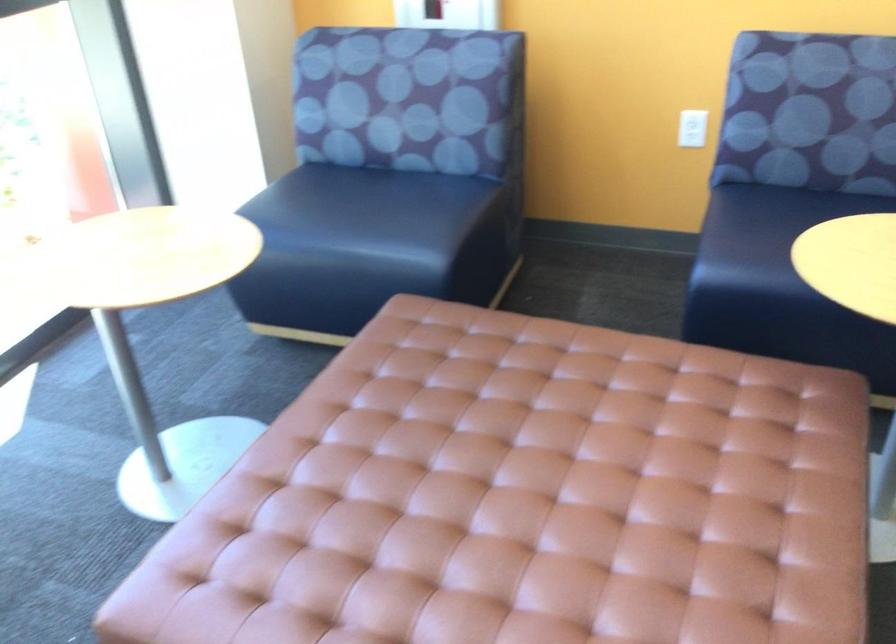
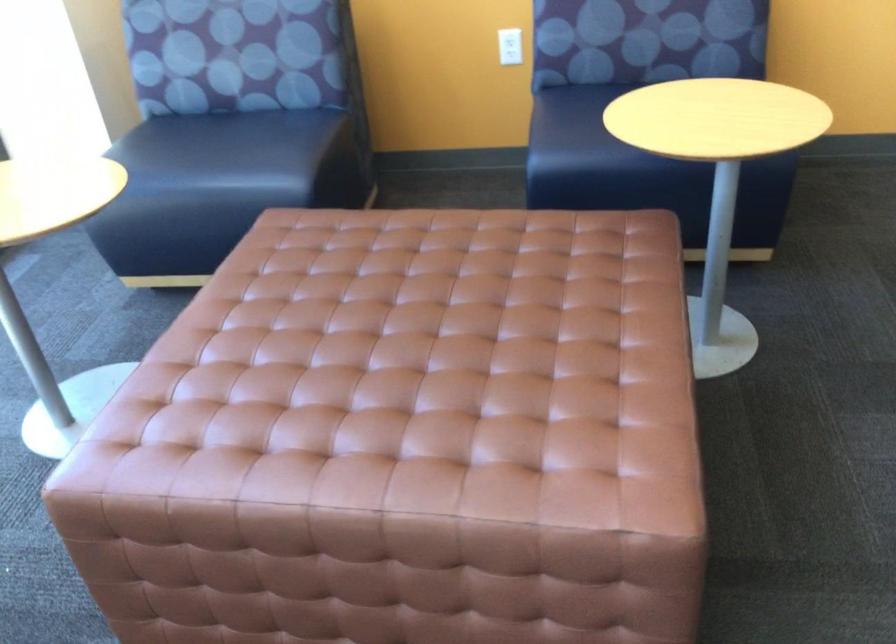
Where in the second image is the point corresponding to pixel 772 266 from the first image?

(593, 146)